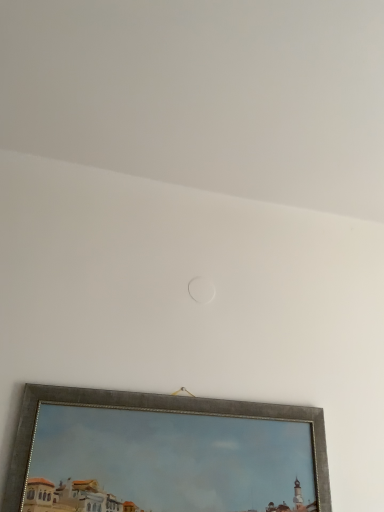
Question: Which direction should I rotate to look at silver metallic picture frame at lower center?

Choices:
 (A) right
 (B) left

Answer: (B)